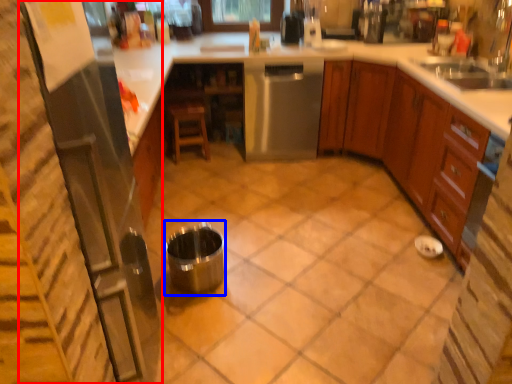
Question: Which of the following is the closest to the observer, appliance (highlighted by a red box) or appliance (highlighted by a blue box)?

Choices:
 (A) appliance
 (B) appliance

Answer: (A)